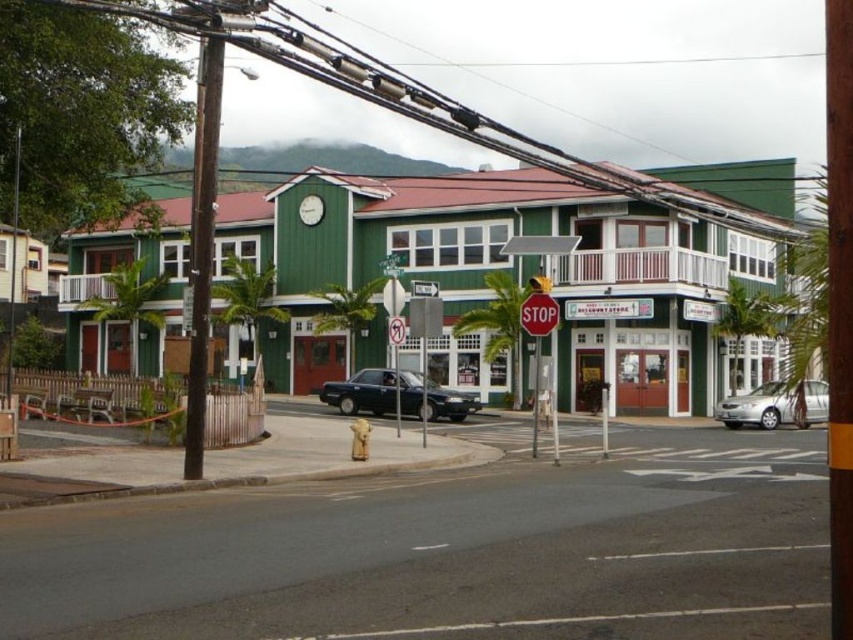
Question: Considering the relative positions of brown wooden pole at center-left and brown wooden pole at left in the image provided, where is brown wooden pole at center-left located with respect to brown wooden pole at left?

Choices:
 (A) above
 (B) below

Answer: (B)

Question: Is satin black sedan at center positioned behind red matte stop sign at center?

Choices:
 (A) yes
 (B) no

Answer: (A)

Question: Estimate the real-world distances between objects in this image. Which object is closer to the white plastic stop sign at center?

Choices:
 (A) green plastic sign at center
 (B) brown wooden pole at center-left
 (C) silver metallic sedan at lower right
 (D) satin black sedan at center

Answer: (A)

Question: Which point is closer to the camera taking this photo?

Choices:
 (A) (200, 212)
 (B) (415, 292)
 (C) (848, 83)

Answer: (C)

Question: Based on their relative distances, which object is nearer to the green wooden building at center?

Choices:
 (A) satin black sedan at center
 (B) brown wooden pole at center-left
 (C) green plastic sign at center
 (D) silver metallic sedan at lower right

Answer: (C)

Question: Is brown wooden pole at center-left wider than brown wooden pole at left?

Choices:
 (A) yes
 (B) no

Answer: (B)